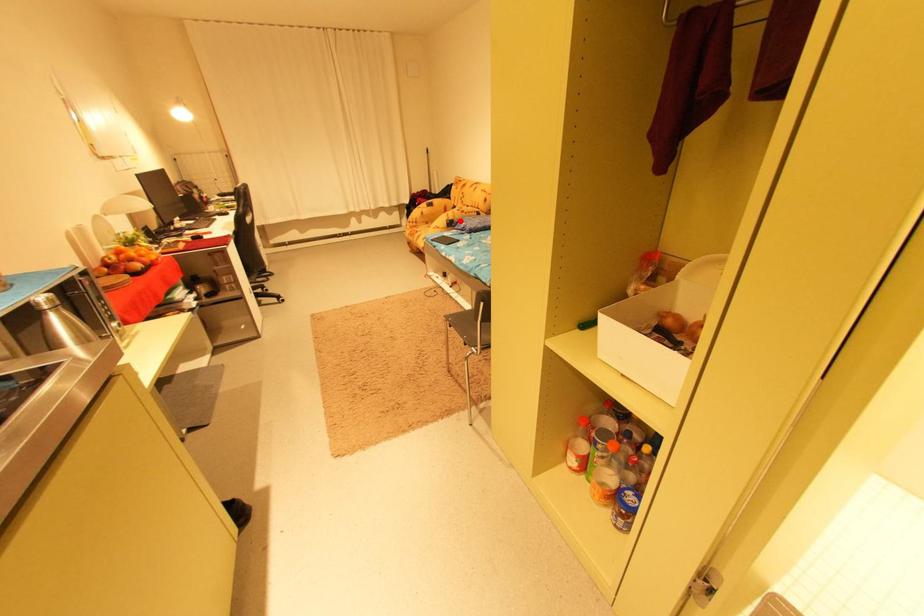
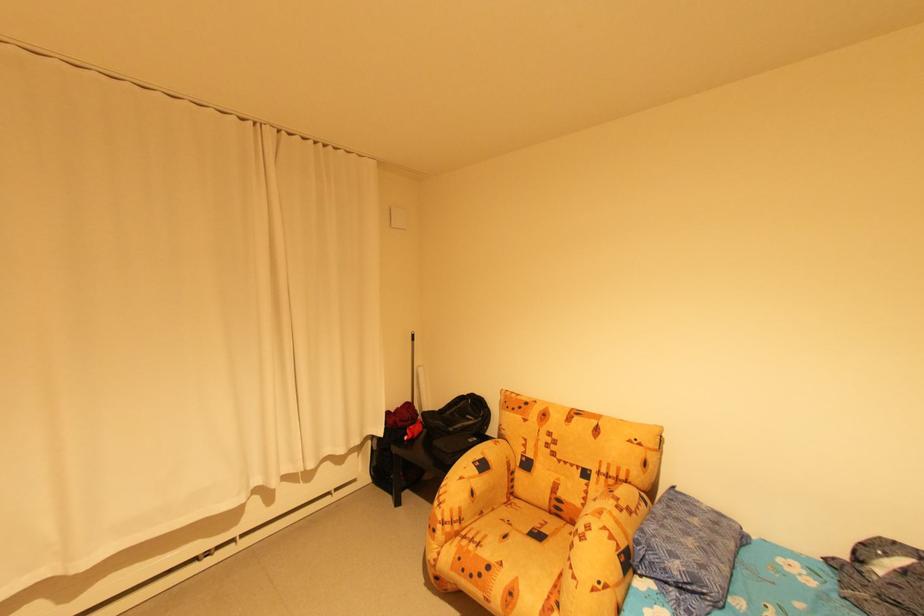
Question: I am providing you with two images of the same scene from different viewpoints. A red point is shown in image1. For the corresponding object point in image2, is it positioned nearer or farther from the camera?

Choices:
 (A) Nearer
 (B) Farther

Answer: (B)